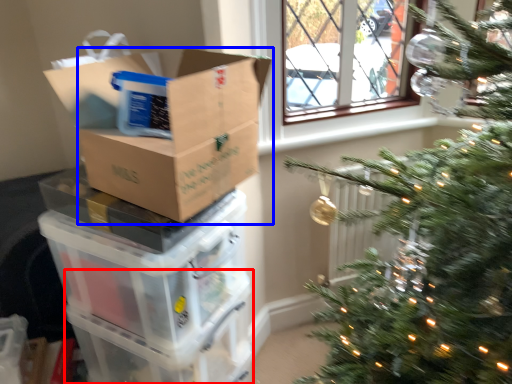
Question: Which point is closer to the camera, glass box (highlighted by a red box) or cardboard box (highlighted by a blue box)?

Choices:
 (A) glass box
 (B) cardboard box

Answer: (B)